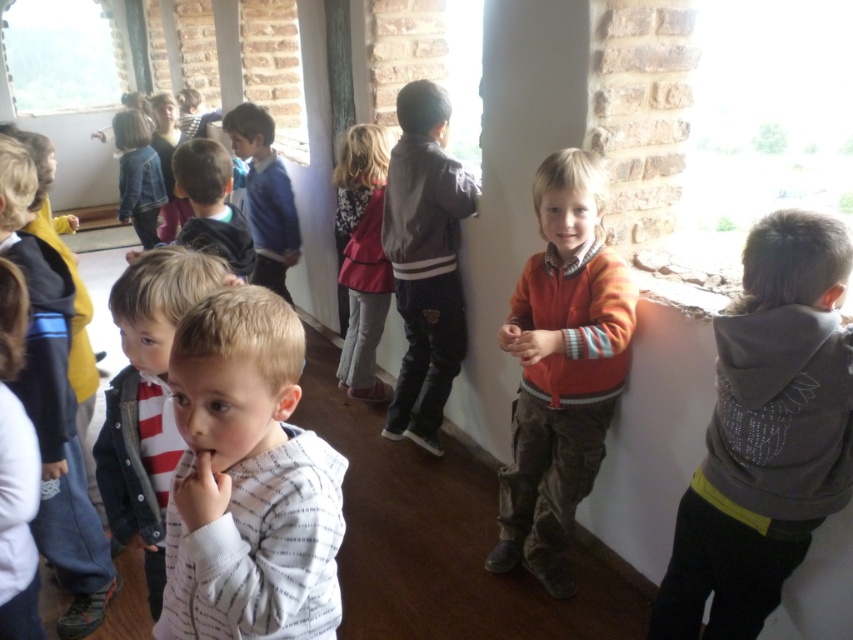
Can you confirm if orange cotton shirt at center is thinner than light pink fabric dress at center?

Incorrect, orange cotton shirt at center's width is not less than light pink fabric dress at center's.

Does orange cotton shirt at center have a greater height compared to light pink fabric dress at center?

Yes, orange cotton shirt at center is taller than light pink fabric dress at center.

Locate an element on the screen. This screenshot has height=640, width=853. orange cotton shirt at center is located at coordinates (561, 369).

Between clear glass window at upper right and light brown hair at center, which one is positioned higher?

clear glass window at upper right is higher up.

Does clear glass window at upper right come behind light brown hair at center?

Yes.

Is point (808, 173) positioned in front of point (221, 225)?

No, it is behind (221, 225).

At what (x,y) coordinates should I click in order to perform the action: click on clear glass window at upper right. Please return your answer as a coordinate pair (x, y). The width and height of the screenshot is (853, 640). Looking at the image, I should click on (764, 122).

Is point (850, 420) less distant than point (321, 508)?

No.

Is gray hoodie at right wider than white striped hoodie at center?

No.

Does point (694, 518) come farther from viewer compared to point (294, 557)?

Yes, point (694, 518) is farther from viewer.

Image resolution: width=853 pixels, height=640 pixels. Identify the location of gray hoodie at right. (766, 433).